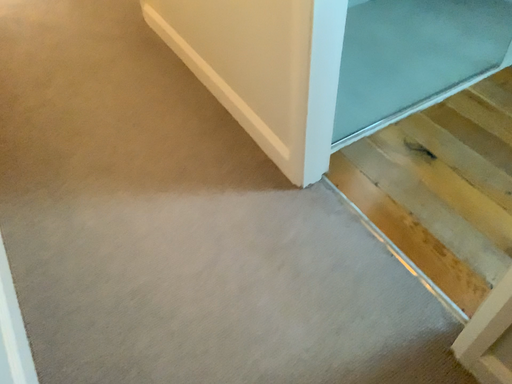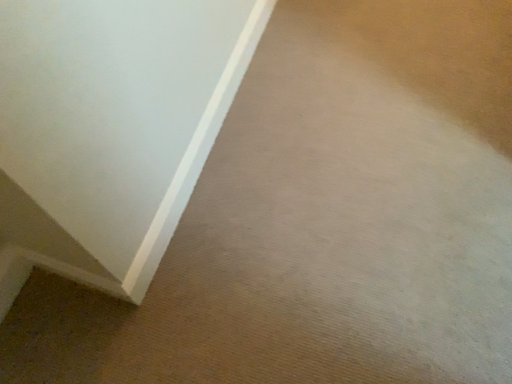
Question: How did the camera likely rotate when shooting the video?

Choices:
 (A) rotated right
 (B) rotated left

Answer: (B)